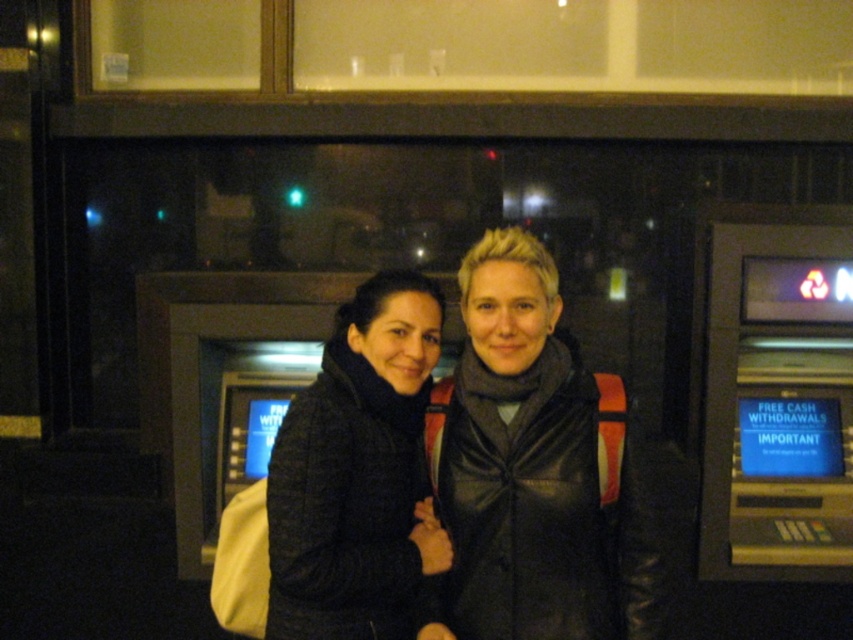
You are a delivery person who needs to place a 1 meter long package between the dark gray leather jacket at center and the metallic gray slot machine at right. Is there enough space to place the package horizontally without moving either object?

The distance between the dark gray leather jacket at center and the metallic gray slot machine at right is 99.12 centimeters. Since the package is 1 meter long, which is longer than the available space, the package cannot be placed horizontally between them without moving either object.

You are a security guard checking the height requirements for the metallic gray slot machine at right. The minimum height requirement is 1.5 meters. Can the dark gray leather jacket at center meet this requirement?

The dark gray leather jacket at center is shorter than the metallic gray slot machine at right, but since the jacket itself is an object and not a person, it cannot meet the height requirement. The security guard should check the height of the person wearing the jacket instead.

You are trying to determine which person is standing closer to the ATM screen. You see the dark gray leather jacket at center and the black fuzzy coat at center. Which one is nearer to you?

The dark gray leather jacket at center is closer to the viewer than the black fuzzy coat at center, so the person wearing the dark gray leather jacket at center is nearer to you.